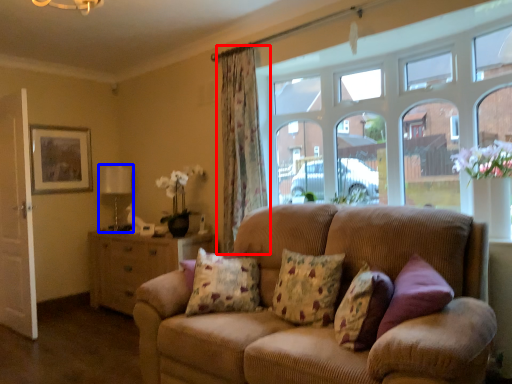
Question: Which object is further to the camera taking this photo, curtain (highlighted by a red box) or lamp (highlighted by a blue box)?

Choices:
 (A) curtain
 (B) lamp

Answer: (B)